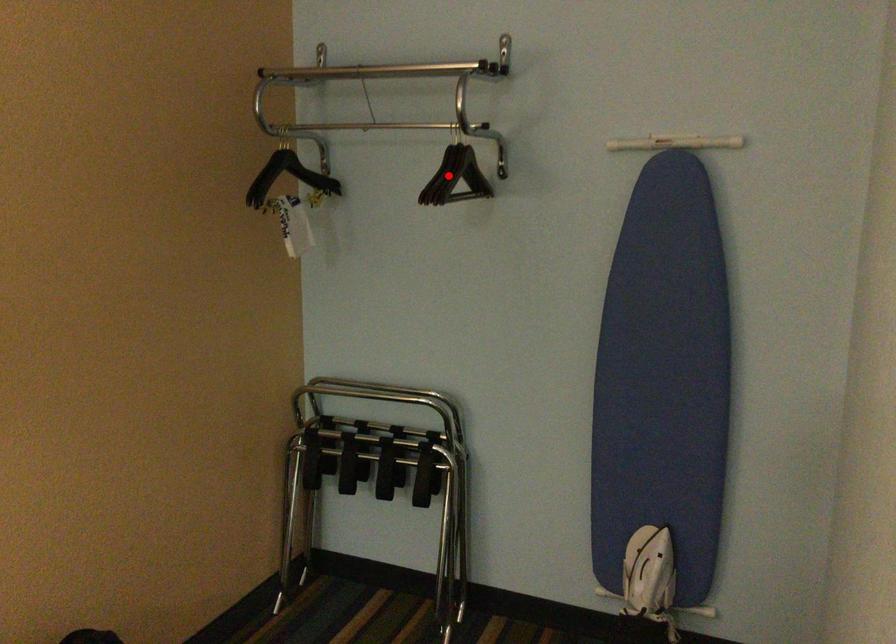
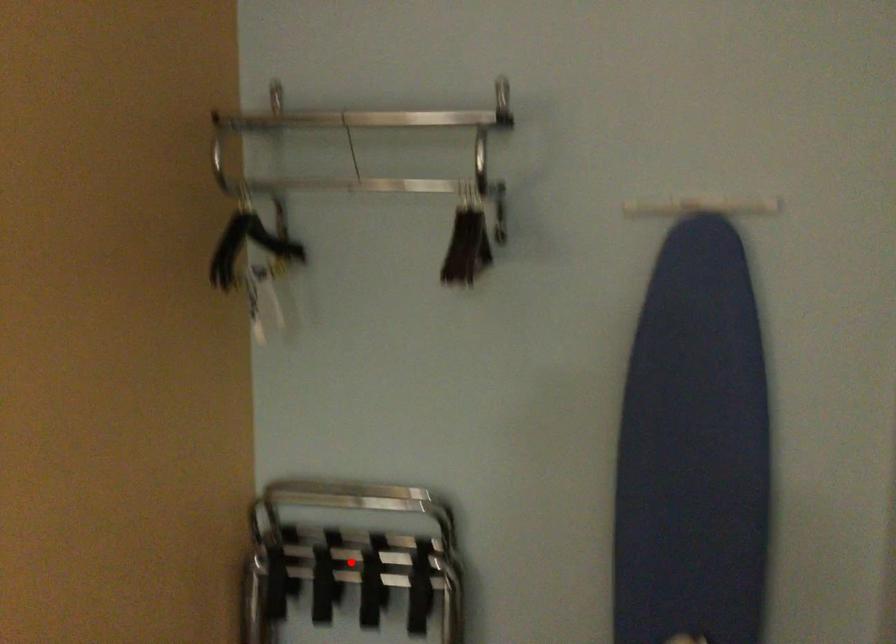
I am providing you with two images of the same scene from different viewpoints. A red point is marked on the first image and another point is marked on the second image. Does the point marked in image1 correspond to the same location as the one in image2?

No